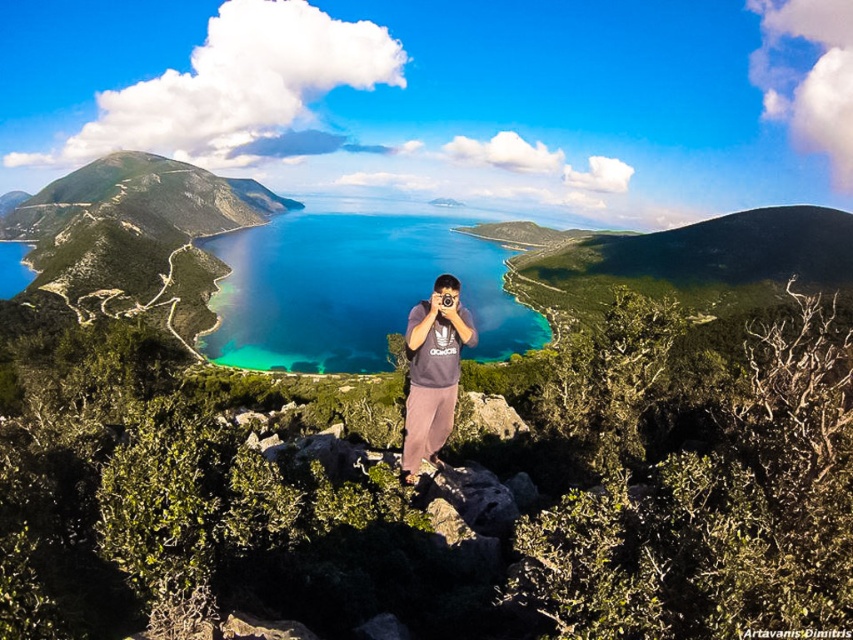
Question: Which object appears closest to the camera in this image?

Choices:
 (A) turquoise glossy water at center
 (B) gray cotton t-shirt at center

Answer: (B)

Question: Observing the image, what is the correct spatial positioning of turquoise glossy water at center in reference to gray cotton t-shirt at center?

Choices:
 (A) below
 (B) above

Answer: (B)

Question: Is turquoise glossy water at center wider than gray cotton t-shirt at center?

Choices:
 (A) yes
 (B) no

Answer: (A)

Question: Is turquoise glossy water at center wider than gray cotton t-shirt at center?

Choices:
 (A) yes
 (B) no

Answer: (A)

Question: Which of the following is the closest to the observer?

Choices:
 (A) (437, 280)
 (B) (254, 348)

Answer: (A)